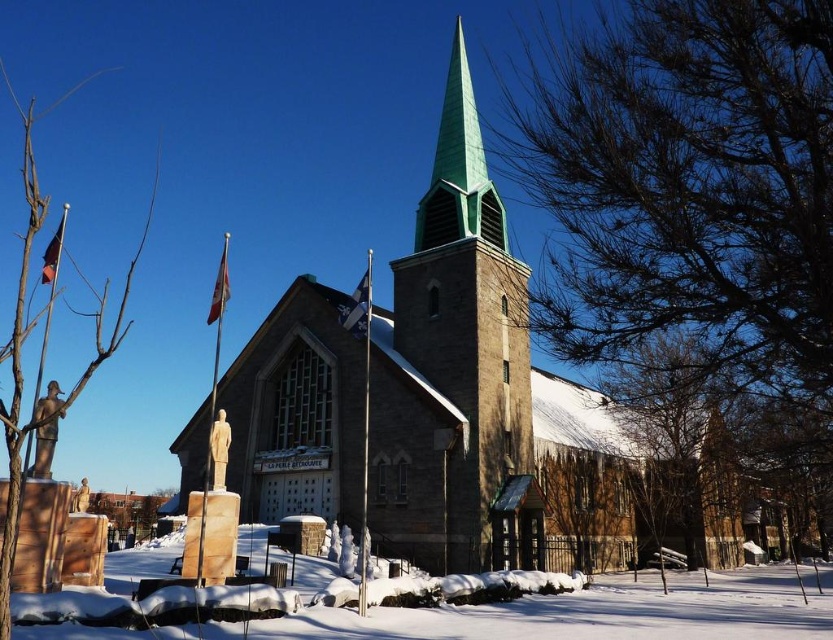
You are standing in front of the church and looking at the snow covered statues and flagpoles. There are two points marked on the image. Which point is closer to you, point (46, 625) or point (15, 97)?

Point (46, 625) is closer to you than point (15, 97).

You are a photographer planning to capture a winter landscape including the brown textured tree at upper right. To ensure the tree is centered in your shot, where should you position your camera relative to the church building?

The brown textured tree at upper right is located at coordinates point (691, 200), so to center it in the shot, position your camera slightly to the left and lower the angle slightly from the top right corner of the church building.

You are planning to take a photo of the brown textured tree at upper right and the white powdery snow at lower center. Which object should you focus on first if you want to capture both in a single frame without moving the camera?

You should focus on the brown textured tree at upper right first because it is larger in size than the white powdery snow at lower center, so it will require more attention in the frame.